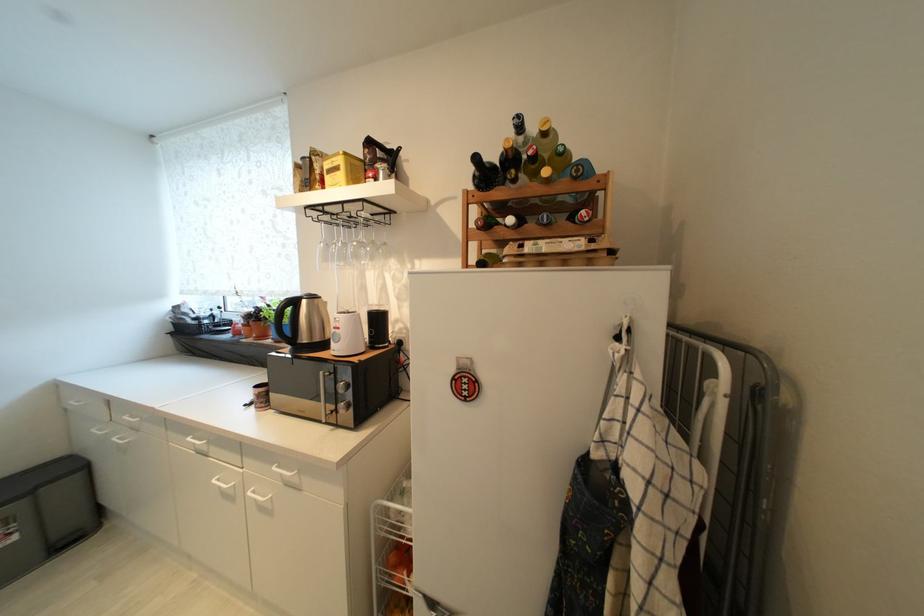
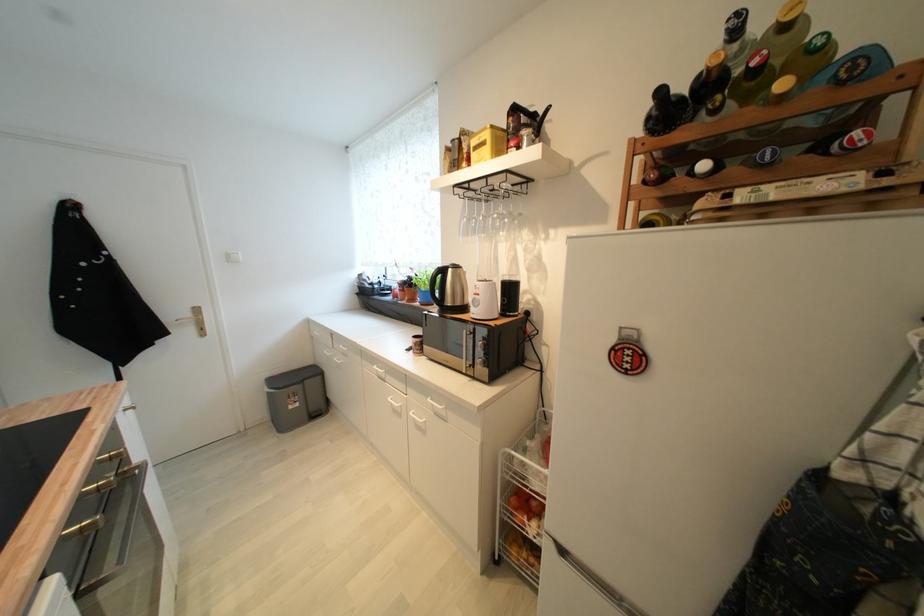
Locate, in the second image, the point that corresponds to (x=371, y=152) in the first image.

(516, 121)